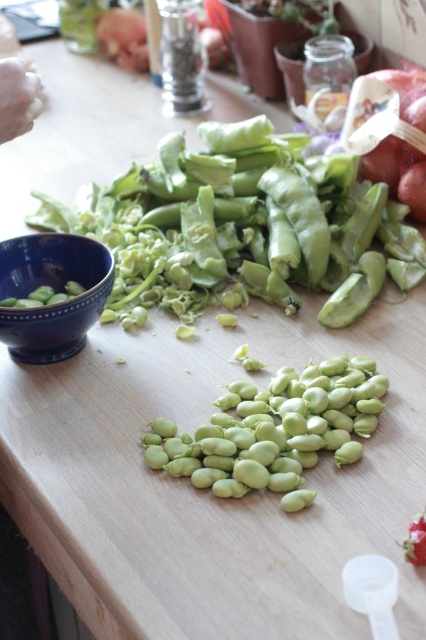
Can you confirm if green matte pod at center is positioned above white flesh hand at upper left?

No, green matte pod at center is not above white flesh hand at upper left.

Locate an element on the screen. green matte pod at center is located at coordinates (244, 225).

This screenshot has height=640, width=426. What are the coordinates of `green matte pod at center` in the screenshot? It's located at (244, 225).

Does green matte pod at center have a lesser width compared to green matte fava beans at center?

No, green matte pod at center is not thinner than green matte fava beans at center.

Is green matte pod at center above green matte fava beans at center?

Yes, green matte pod at center is above green matte fava beans at center.

Identify the location of green matte pod at center. The image size is (426, 640). (244, 225).

Is green matte fava beans at center above white flesh hand at upper left?

Actually, green matte fava beans at center is below white flesh hand at upper left.

Between green matte fava beans at center and white flesh hand at upper left, which one has less height?

Standing shorter between the two is white flesh hand at upper left.

Who is more forward, (322,381) or (14,136)?

Point (14,136)

You are a GUI agent. You are given a task and a screenshot of the screen. Output one action in this format:
    pyautogui.click(x=<x>, y=<y>)
    Task: Click on the green matte fava beans at center
    Image resolution: width=426 pixels, height=640 pixels.
    Given the screenshot: What is the action you would take?
    tap(275, 429)